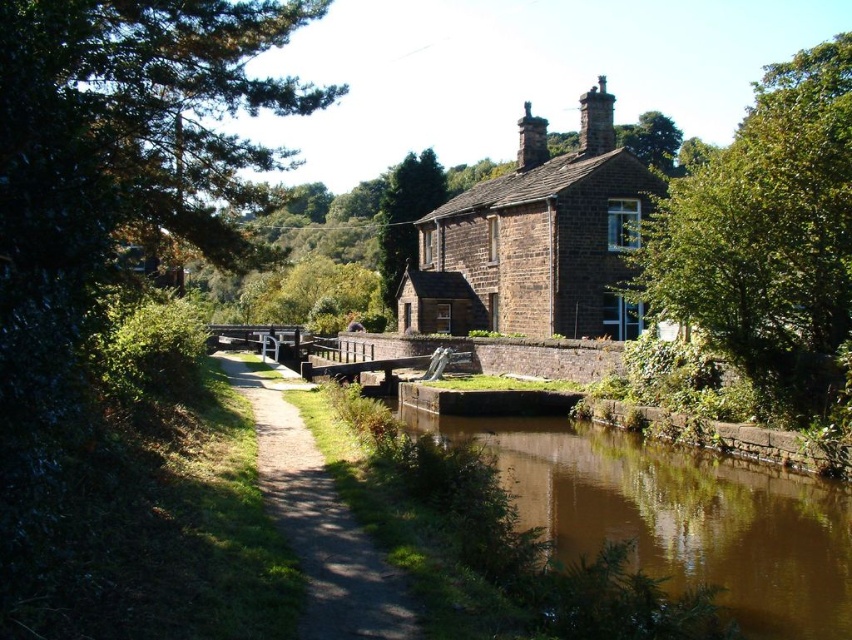
Question: Which point is closer to the camera?

Choices:
 (A) (269, 412)
 (B) (416, 211)

Answer: (A)

Question: Which point is farther to the camera?

Choices:
 (A) green leafy tree at upper center
 (B) brown stone cottage at center
 (C) brown gravel path at center
 (D) green leafy tree at left

Answer: (B)

Question: Does green leafy tree at left have a smaller size compared to brown gravel path at center?

Choices:
 (A) yes
 (B) no

Answer: (B)

Question: Among these points, which one is farthest from the camera?

Choices:
 (A) (355, 595)
 (B) (78, 48)
 (C) (806, 301)
 (D) (824, 596)

Answer: (C)

Question: Does green leafy tree at upper center have a larger size compared to brown stone cottage at center?

Choices:
 (A) no
 (B) yes

Answer: (B)

Question: Does green leafy tree at upper center have a smaller size compared to brown gravel path at center?

Choices:
 (A) no
 (B) yes

Answer: (A)